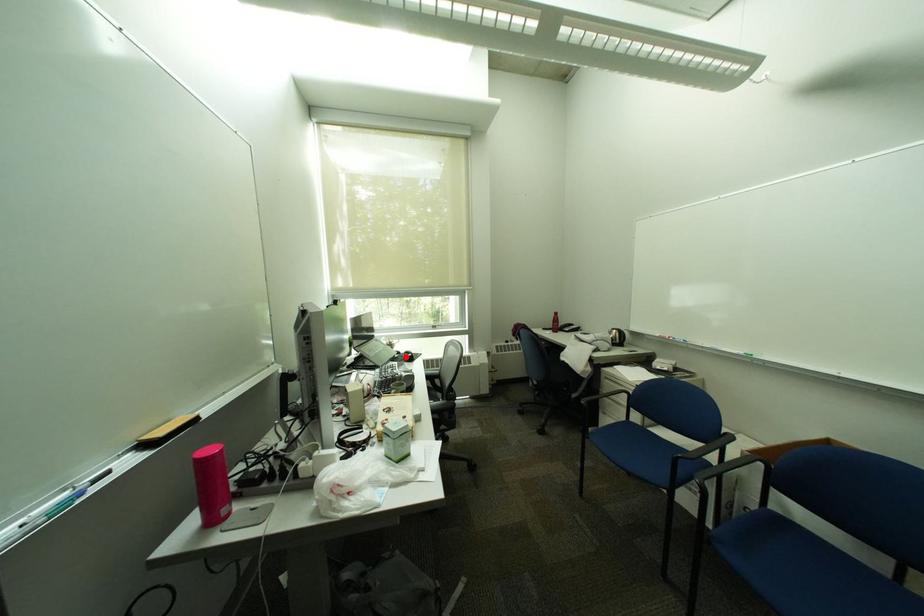
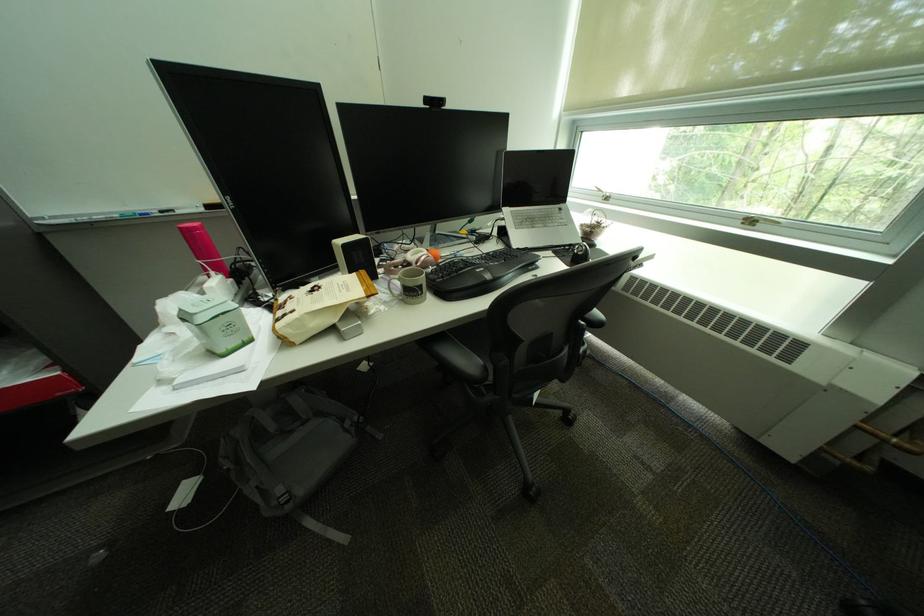
Locate, in the second image, the point that corresponds to the highlighted location in the first image.

(580, 246)